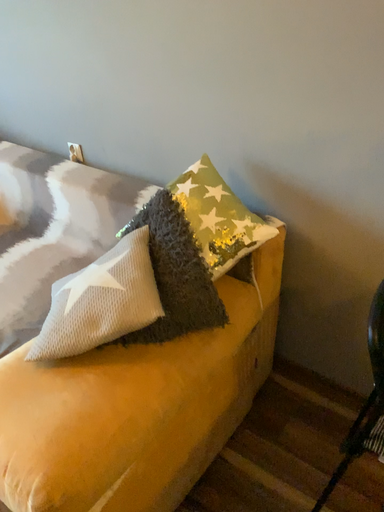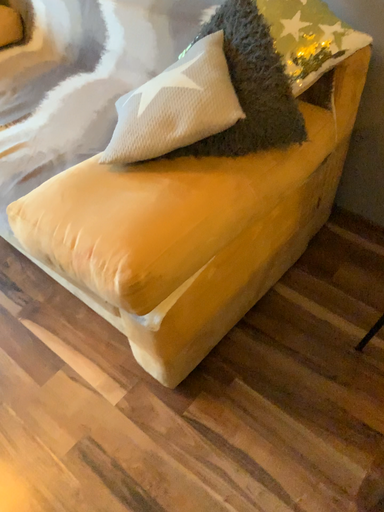
Question: Which way did the camera rotate in the video?

Choices:
 (A) rotated downward
 (B) rotated upward

Answer: (A)